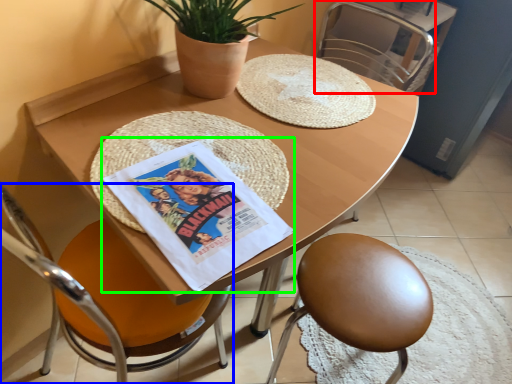
Question: Estimate the real-world distances between objects in this image. Which object is closer to chair (highlighted by a red box), chair (highlighted by a blue box) or comic book (highlighted by a green box)?

Choices:
 (A) chair
 (B) comic book

Answer: (B)